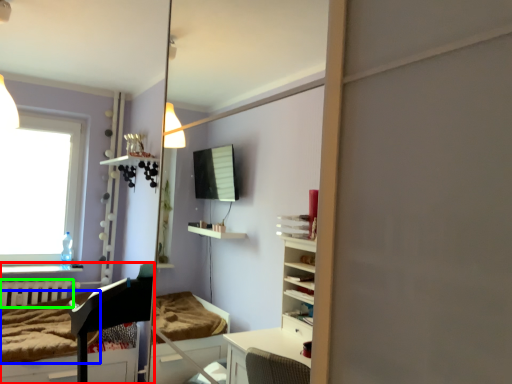
Question: Which is nearer to the furniture (highlighted by a red box)? mattress (highlighted by a blue box) or radiator (highlighted by a green box).

Choices:
 (A) mattress
 (B) radiator

Answer: (A)